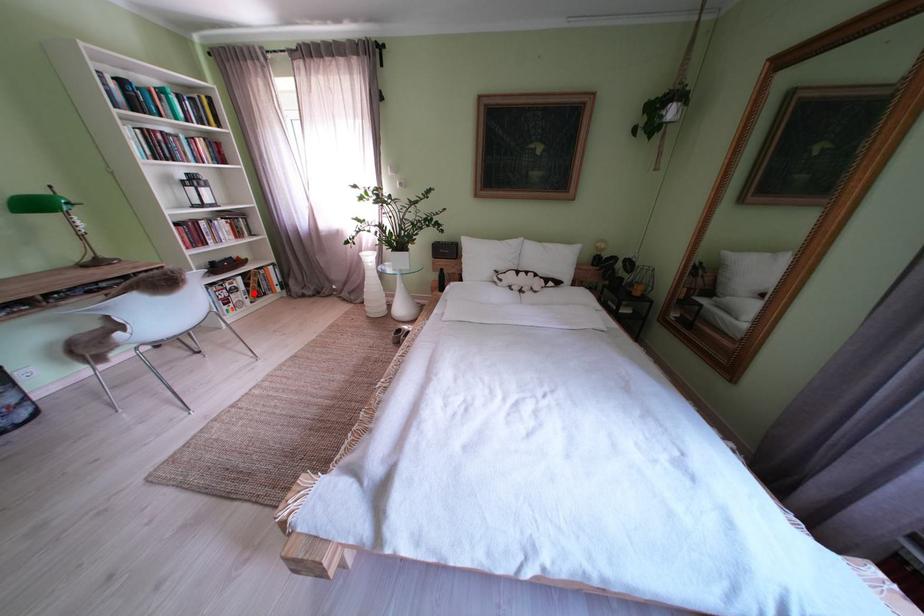
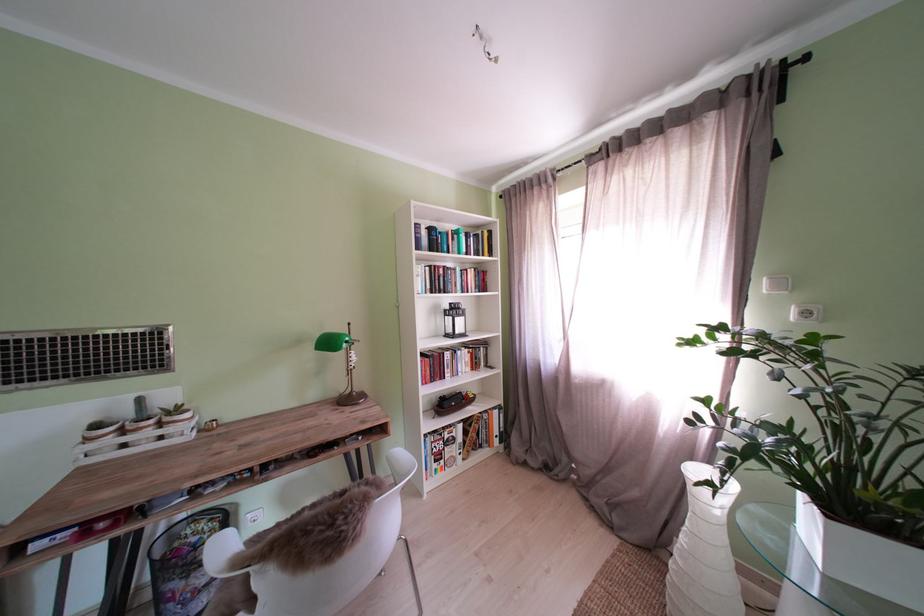
Question: I am providing you with two images of the same scene from different viewpoints. Given a red point in image1, look at the same physical point in image2. Is it:

Choices:
 (A) Closer to the viewpoint
 (B) Farther from the viewpoint

Answer: (B)